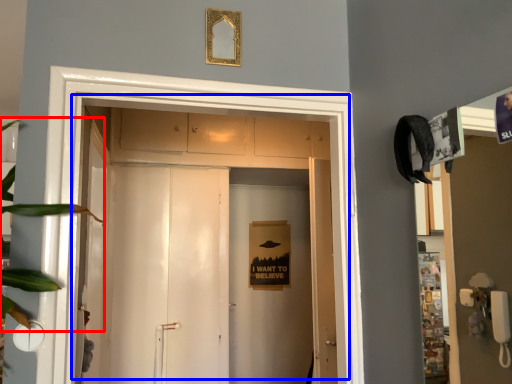
Question: Which object appears farthest to the camera in this image, plant (highlighted by a red box) or door (highlighted by a blue box)?

Choices:
 (A) plant
 (B) door

Answer: (B)